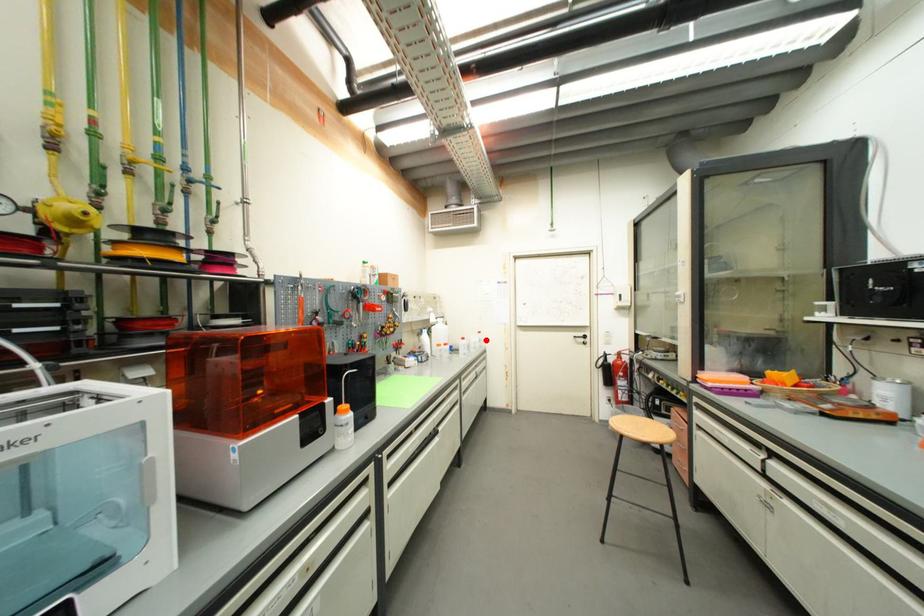
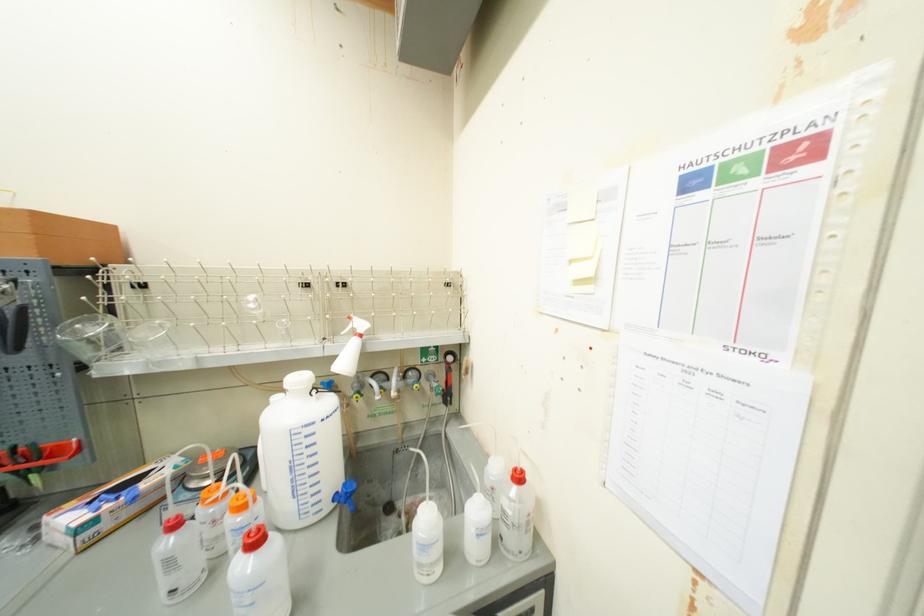
Locate, in the second image, the point that corresponds to the highlighted location in the first image.

(515, 514)